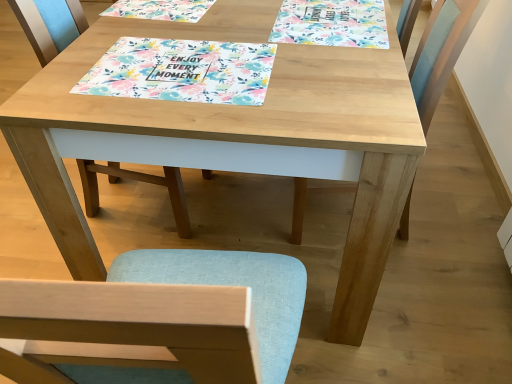
Question: Is floral paper placemat at upper center thinner than floral paper placemat at center?

Choices:
 (A) no
 (B) yes

Answer: (B)

Question: Does floral paper placemat at upper center have a greater width compared to floral paper placemat at center?

Choices:
 (A) no
 (B) yes

Answer: (A)

Question: Is floral paper placemat at upper center oriented away from floral paper placemat at center?

Choices:
 (A) yes
 (B) no

Answer: (B)

Question: From the image's perspective, is floral paper placemat at upper center beneath floral paper placemat at center?

Choices:
 (A) no
 (B) yes

Answer: (A)

Question: Is floral paper placemat at upper center shorter than floral paper placemat at center?

Choices:
 (A) yes
 (B) no

Answer: (B)

Question: Would you say floral paper placemat at upper center is to the left or to the right of light blue fabric chair at center, the first chair in the left-to-right sequence, in the picture?

Choices:
 (A) left
 (B) right

Answer: (B)

Question: Considering their positions, is floral paper placemat at upper center located in front of or behind light blue fabric chair at center, the first chair in the left-to-right sequence?

Choices:
 (A) behind
 (B) front

Answer: (A)

Question: From a real-world perspective, relative to light blue fabric chair at center, the first chair in the left-to-right sequence, is floral paper placemat at upper center vertically above or below?

Choices:
 (A) below
 (B) above

Answer: (B)

Question: Is floral paper placemat at upper center wider or thinner than light blue fabric chair at center, the second chair when ordered from right to left?

Choices:
 (A) thin
 (B) wide

Answer: (A)

Question: From a real-world perspective, is light blue fabric chair at center, the first chair in the left-to-right sequence, physically located above or below light blue fabric chair at right, the 2th chair when ordered from left to right?

Choices:
 (A) below
 (B) above

Answer: (A)

Question: From the image's perspective, is light blue fabric chair at center, the second chair when ordered from right to left, positioned above or below light blue fabric chair at right, the 2th chair when ordered from left to right?

Choices:
 (A) above
 (B) below

Answer: (A)

Question: Is light blue fabric chair at center, the first chair in the left-to-right sequence, to the left or to the right of light blue fabric chair at right, the 2th chair when ordered from left to right, in the image?

Choices:
 (A) right
 (B) left

Answer: (B)

Question: Based on their sizes in the image, would you say light blue fabric chair at center, the first chair in the left-to-right sequence, is bigger or smaller than light blue fabric chair at right, which is the first chair from right to left?

Choices:
 (A) small
 (B) big

Answer: (A)

Question: Looking at their shapes, would you say floral paper placemat at center is wider or thinner than light blue fabric chair at center, the first chair in the left-to-right sequence?

Choices:
 (A) thin
 (B) wide

Answer: (A)

Question: Would you say floral paper placemat at center is to the left or to the right of light blue fabric chair at center, the first chair in the left-to-right sequence, in the picture?

Choices:
 (A) right
 (B) left

Answer: (A)